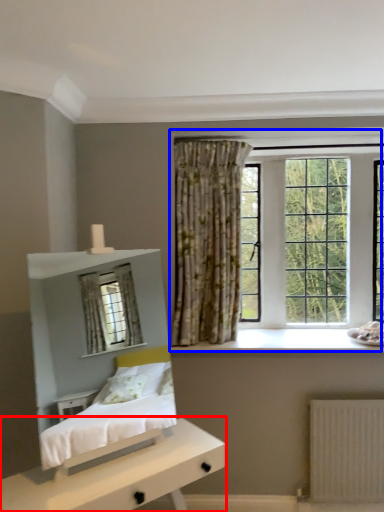
Question: Among these objects, which one is farthest to the camera, nightstand (highlighted by a red box) or window (highlighted by a blue box)?

Choices:
 (A) nightstand
 (B) window

Answer: (B)